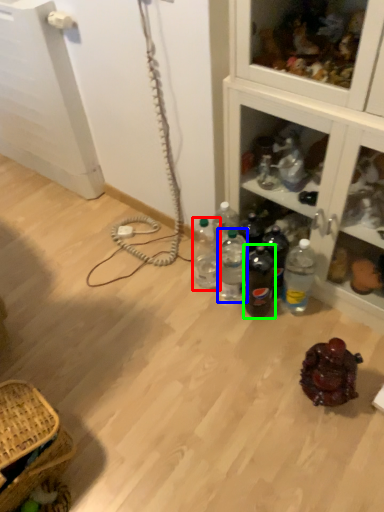
Question: Considering the real-world distances, which object is closest to bottle (highlighted by a red box)? bottle (highlighted by a blue box) or bottle (highlighted by a green box).

Choices:
 (A) bottle
 (B) bottle

Answer: (A)